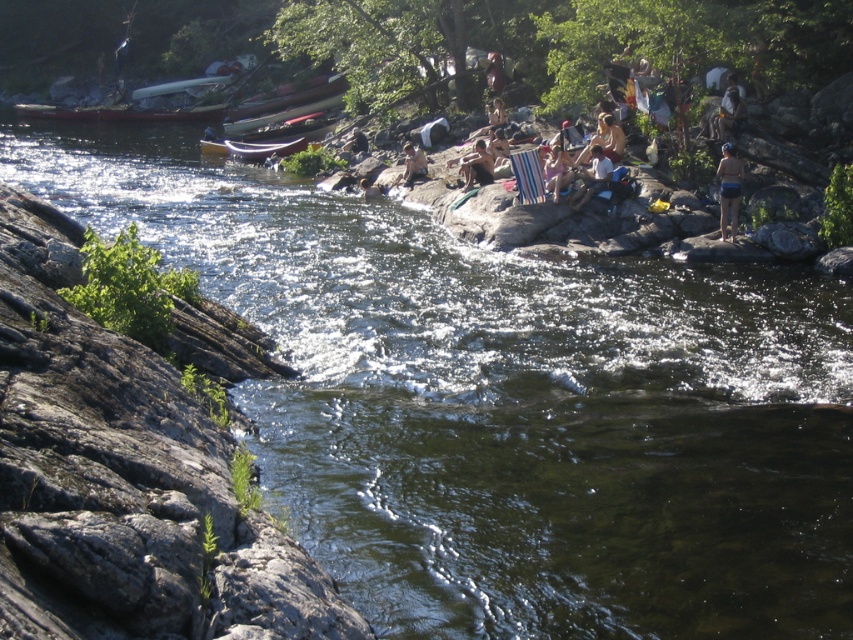
Is the position of matte brown canoe at upper left less distant than that of brown leather backpack at center?

No.

Describe the element at coordinates (120, 113) in the screenshot. I see `matte brown canoe at upper left` at that location.

At what (x,y) coordinates should I click in order to perform the action: click on matte brown canoe at upper left. Please return your answer as a coordinate pair (x, y). Looking at the image, I should click on (120, 113).

Which is below, matte brown canoe at upper left or white cotton shirt at center?

Positioned lower is white cotton shirt at center.

Is matte brown canoe at upper left positioned at the back of white cotton shirt at center?

Yes, it is behind white cotton shirt at center.

Where is `matte brown canoe at upper left`? The height and width of the screenshot is (640, 853). matte brown canoe at upper left is located at coordinates (120, 113).

The image size is (853, 640). In order to click on matte brown canoe at upper left in this screenshot , I will do `click(120, 113)`.

Looking at this image, which is more to the left, matte white canoe at center or striped fabric bag at center?

From the viewer's perspective, matte white canoe at center appears more on the left side.

Between matte white canoe at center and striped fabric bag at center, which one has more height?

Standing taller between the two is striped fabric bag at center.

Between point (242, 148) and point (556, 177), which one is positioned in front?

Point (556, 177) is more forward.

Identify the location of matte white canoe at center. The image size is (853, 640). (252, 148).